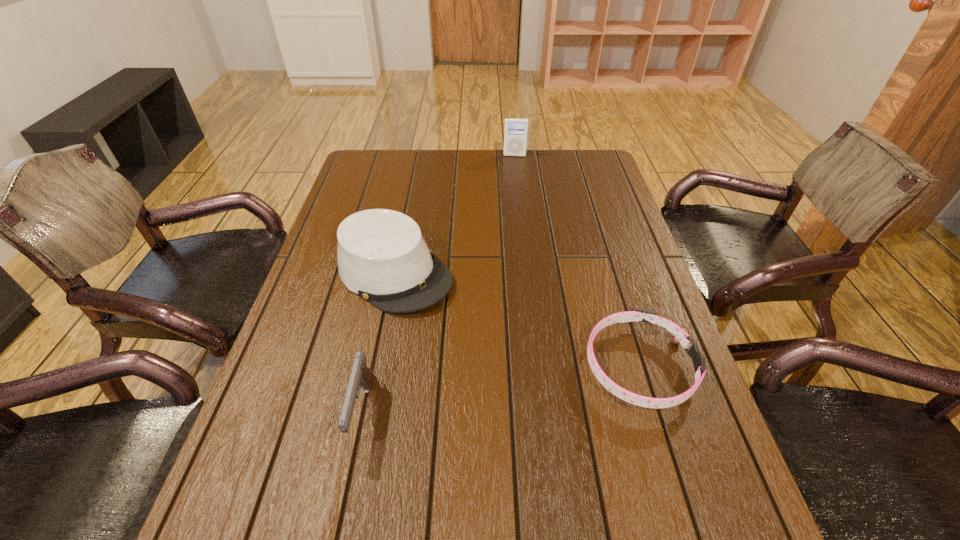
Find the location of `unoccupied area between the hat and the dog collar`. unoccupied area between the hat and the dog collar is located at coordinates (516, 320).

The image size is (960, 540). Find the location of `free space between the second object from right to left and the dog collar`. free space between the second object from right to left and the dog collar is located at coordinates (576, 261).

Identify the location of empty space between the pistol and the third nearest object. (378, 342).

This screenshot has width=960, height=540. In order to click on object that stands as the second closest to the dog collar in this screenshot , I will do `click(361, 375)`.

Point out which object is positioned as the nearest to the pistol. Please provide its 2D coordinates. Your answer should be formatted as a tuple, i.e. [(x, y)], where the tuple contains the x and y coordinates of a point satisfying the conditions above.

[(382, 256)]

Image resolution: width=960 pixels, height=540 pixels. I want to click on vacant area in the image that satisfies the following two spatial constraints: 1. on the front side of the iPod; 2. with the buckle on the shortest object, so click(539, 367).

Find the location of a particular element. Image resolution: width=960 pixels, height=540 pixels. vacant space that satisfies the following two spatial constraints: 1. on the front side of the dog collar; 2. with the buckle on the second farthest object is located at coordinates (375, 367).